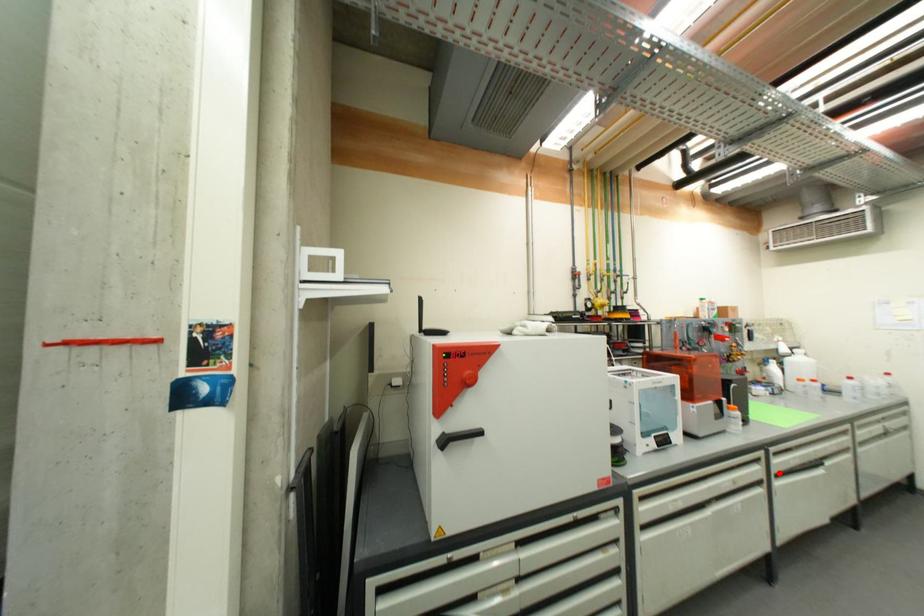
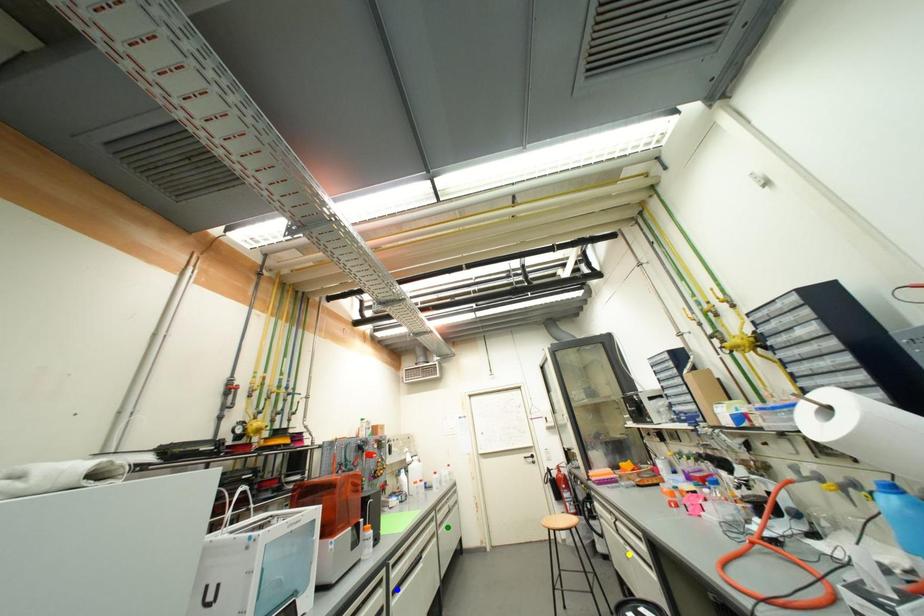
Question: I am providing you with two images of the same scene from different viewpoints. A red point is marked on the first image. You are given multiple points on the second image. Which point in image 2 is actually the same real-world point as the red point in image 1?

Choices:
 (A) yellow point
 (B) blue point
 (C) green point

Answer: (B)